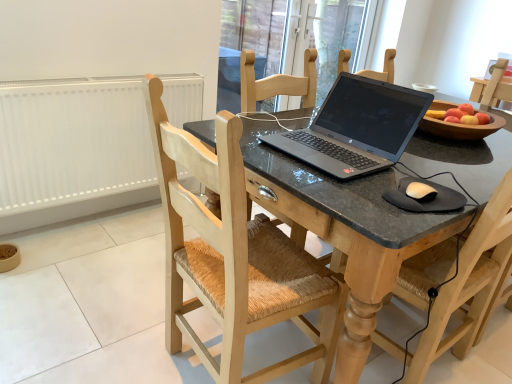
Question: Is the depth of matte black laptop at center less than that of light wood chair at center, which appears as the second chair when viewed from the right?

Choices:
 (A) no
 (B) yes

Answer: (A)

Question: Considering the relative positions of matte black laptop at center and light wood chair at center, which appears as the second chair when viewed from the right, in the image provided, is matte black laptop at center to the left of light wood chair at center, which appears as the second chair when viewed from the right, from the viewer's perspective?

Choices:
 (A) no
 (B) yes

Answer: (A)

Question: Can you confirm if matte black laptop at center is bigger than light wood chair at center, positioned as the 1th chair in left-to-right order?

Choices:
 (A) no
 (B) yes

Answer: (B)

Question: Can you confirm if matte black laptop at center is taller than light wood chair at center, which appears as the second chair when viewed from the right?

Choices:
 (A) yes
 (B) no

Answer: (B)

Question: Is matte black laptop at center outside of light wood chair at center, positioned as the 1th chair in left-to-right order?

Choices:
 (A) no
 (B) yes

Answer: (B)

Question: Looking at the image, does black rubber mousepad at lower right seem bigger or smaller compared to transparent glass door at upper center?

Choices:
 (A) big
 (B) small

Answer: (B)

Question: In the image, is black rubber mousepad at lower right on the left side or the right side of transparent glass door at upper center?

Choices:
 (A) left
 (B) right

Answer: (B)

Question: In the image, is black rubber mousepad at lower right positioned in front of or behind transparent glass door at upper center?

Choices:
 (A) behind
 (B) front

Answer: (B)

Question: From a real-world perspective, is black rubber mousepad at lower right above or below transparent glass door at upper center?

Choices:
 (A) below
 (B) above

Answer: (B)

Question: Considering the positions of transparent glass door at upper center and matte black laptop at center in the image, is transparent glass door at upper center wider or thinner than matte black laptop at center?

Choices:
 (A) thin
 (B) wide

Answer: (A)

Question: Which is correct: transparent glass door at upper center is inside matte black laptop at center, or outside of it?

Choices:
 (A) outside
 (B) inside

Answer: (A)

Question: From the image's perspective, is transparent glass door at upper center positioned above or below matte black laptop at center?

Choices:
 (A) below
 (B) above

Answer: (B)

Question: From a real-world perspective, relative to matte black laptop at center, is transparent glass door at upper center vertically above or below?

Choices:
 (A) below
 (B) above

Answer: (B)

Question: Looking at their shapes, would you say white matte mouse at lower right is wider or thinner than matte black laptop at center?

Choices:
 (A) wide
 (B) thin

Answer: (B)

Question: Which is correct: white matte mouse at lower right is inside matte black laptop at center, or outside of it?

Choices:
 (A) inside
 (B) outside

Answer: (B)